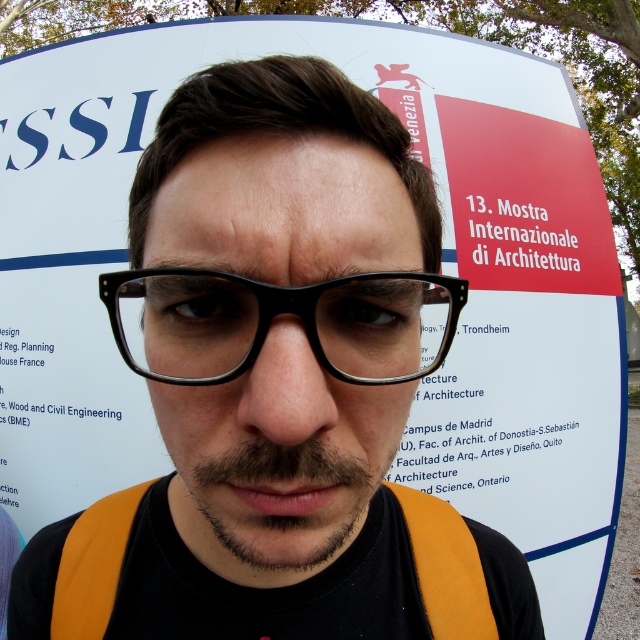
From the picture: You are a photographer trying to capture a portrait of the person in the image. You notice the black plastic glasses at center and the dark brown stubble at center. Which object is closer to your camera lens?

The black plastic glasses at center is closer to the camera lens because it is further to the viewer than the dark brown stubble at center.